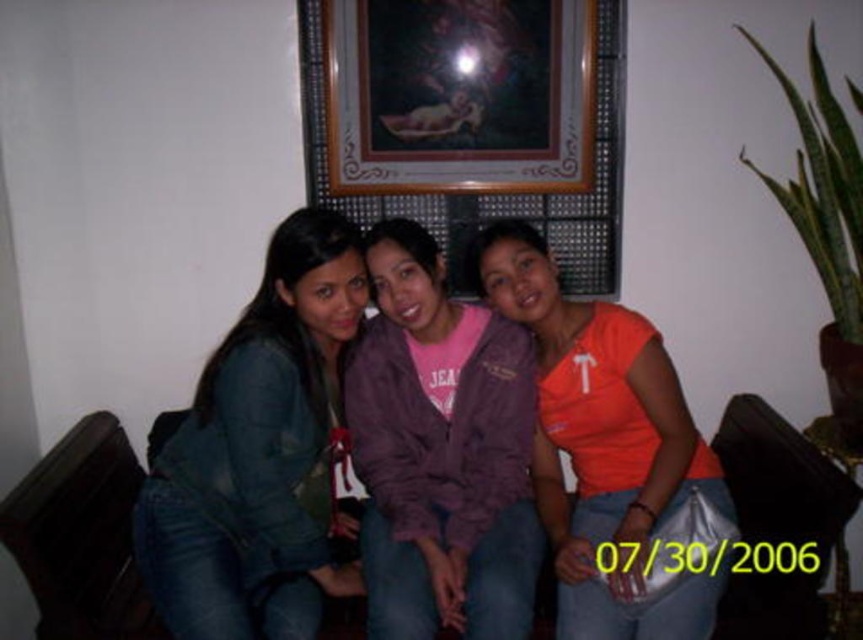
Does point (399, 284) come farther from viewer compared to point (722, 572)?

Yes, it is.

Does point (468, 369) come closer to viewer compared to point (647, 451)?

No, (468, 369) is behind (647, 451).

Which is behind, point (404, 403) or point (675, 600)?

Point (404, 403)

Find the location of `purple fleece jacket at center`. purple fleece jacket at center is located at coordinates (439, 451).

You are a GUI agent. You are given a task and a screenshot of the screen. Output one action in this format:
    pyautogui.click(x=<x>, y=<y>)
    Task: Click on the orange matte shirt at center
    The height and width of the screenshot is (640, 863).
    Given the screenshot: What is the action you would take?
    pyautogui.click(x=603, y=442)

Find the location of a particular element. Image resolution: width=863 pixels, height=640 pixels. denim jacket at center is located at coordinates (260, 452).

Between denim jacket at center and orange matte shirt at center, which one is positioned lower?

orange matte shirt at center

Describe the element at coordinates (260, 452) in the screenshot. Image resolution: width=863 pixels, height=640 pixels. I see `denim jacket at center` at that location.

Find the location of a particular element. denim jacket at center is located at coordinates (260, 452).